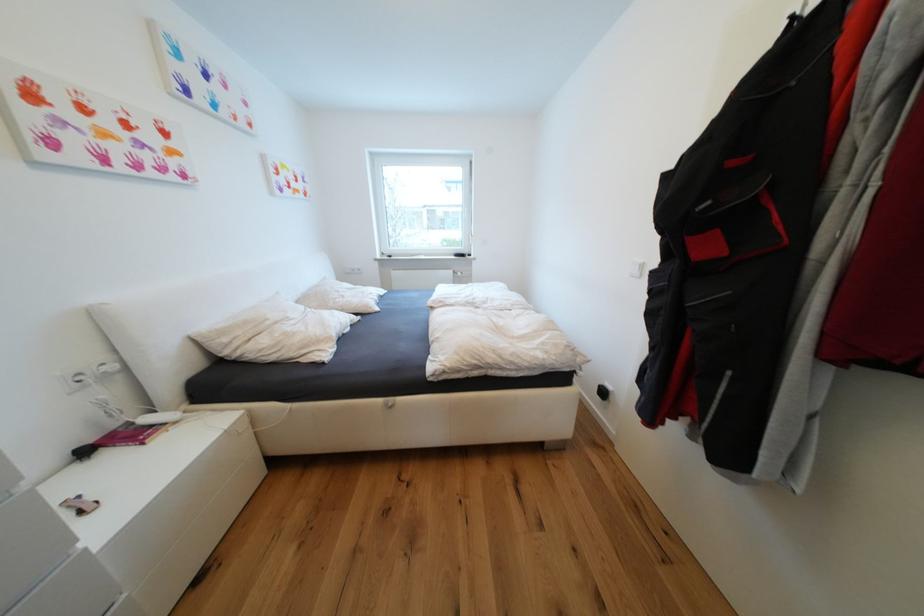
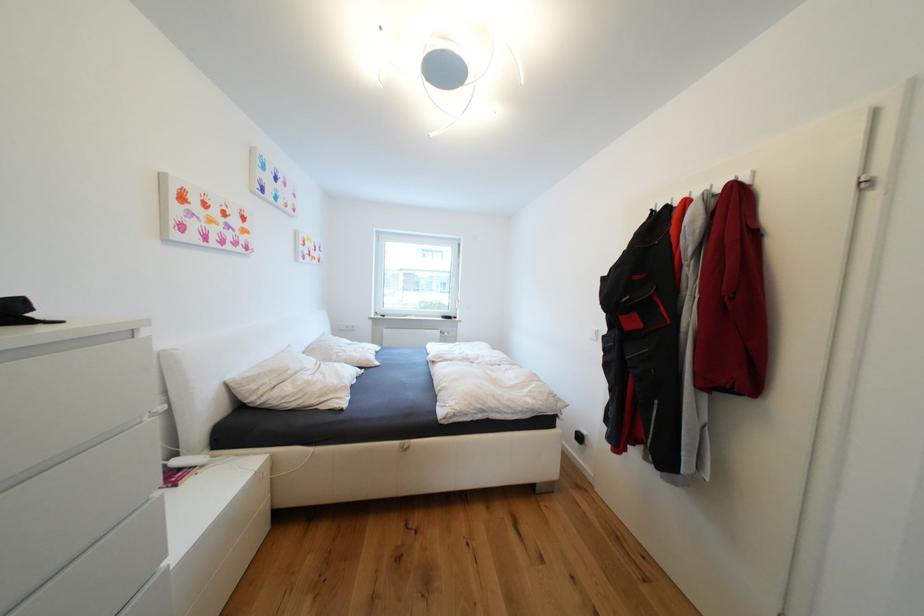
Question: I am providing you with two images of the same scene from different viewpoints. Please identify which objects are invisible in image2.

Choices:
 (A) white drawer front
 (B) metal coat hook
 (C) white pillow
 (D) none of these

Answer: (D)